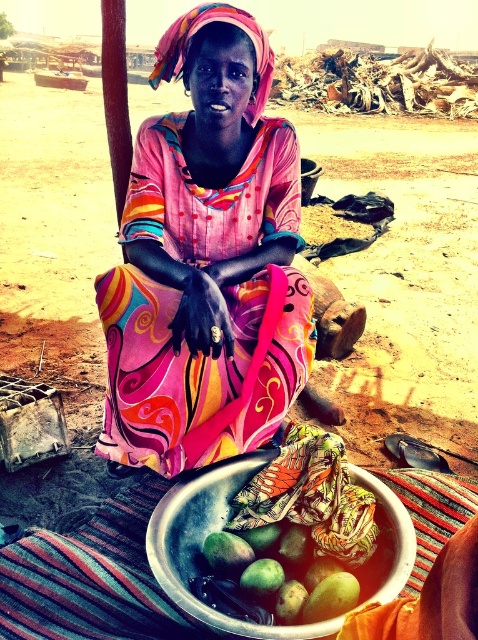
Question: Is matte pink dress at center positioned behind metallic silver bowl at lower center?

Choices:
 (A) yes
 (B) no

Answer: (A)

Question: Does matte pink dress at center appear on the left side of green matte mangoes at lower center?

Choices:
 (A) no
 (B) yes

Answer: (B)

Question: Is metallic silver bowl at lower center above green matte mangoes at lower center?

Choices:
 (A) yes
 (B) no

Answer: (A)

Question: Based on their relative distances, which object is nearer to the matte pink dress at center?

Choices:
 (A) metallic silver bowl at lower center
 (B) green matte mangoes at lower center

Answer: (A)

Question: Among these points, which one is farthest from the camera?

Choices:
 (A) (402, 580)
 (B) (262, 168)
 (C) (261, 531)

Answer: (B)

Question: Estimate the real-world distances between objects in this image. Which object is closer to the green matte mangoes at lower center?

Choices:
 (A) matte pink dress at center
 (B) metallic silver bowl at lower center

Answer: (B)